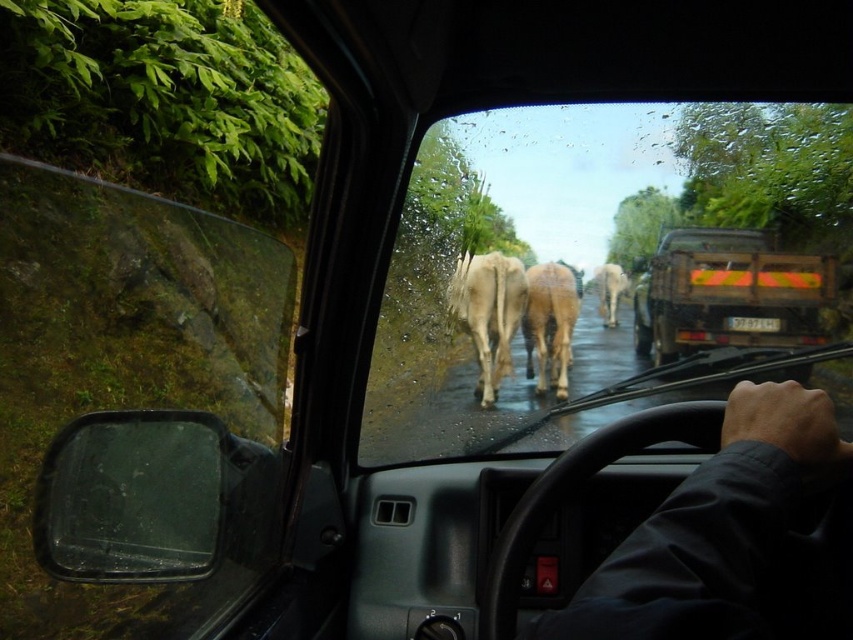
Question: Is transparent plastic side mirror at lower left positioned before wooden planks truck at center?

Choices:
 (A) no
 (B) yes

Answer: (B)

Question: Does wooden planks truck at center appear on the left side of white smooth cow at center?

Choices:
 (A) no
 (B) yes

Answer: (A)

Question: Among these objects, which one is nearest to the camera?

Choices:
 (A) light brown fur at center
 (B) white matte cow at center
 (C) wooden planks truck at center
 (D) white smooth cow at center

Answer: (D)

Question: Among these objects, which one is farthest from the camera?

Choices:
 (A) wooden planks truck at center
 (B) transparent glass windshield at center
 (C) dark fabric hand at center

Answer: (A)

Question: Is white smooth cow at center thinner than light brown fur at center?

Choices:
 (A) yes
 (B) no

Answer: (B)

Question: Estimate the real-world distances between objects in this image. Which object is farther from the white matte cow at center?

Choices:
 (A) light brown fur at center
 (B) wooden planks truck at center

Answer: (B)